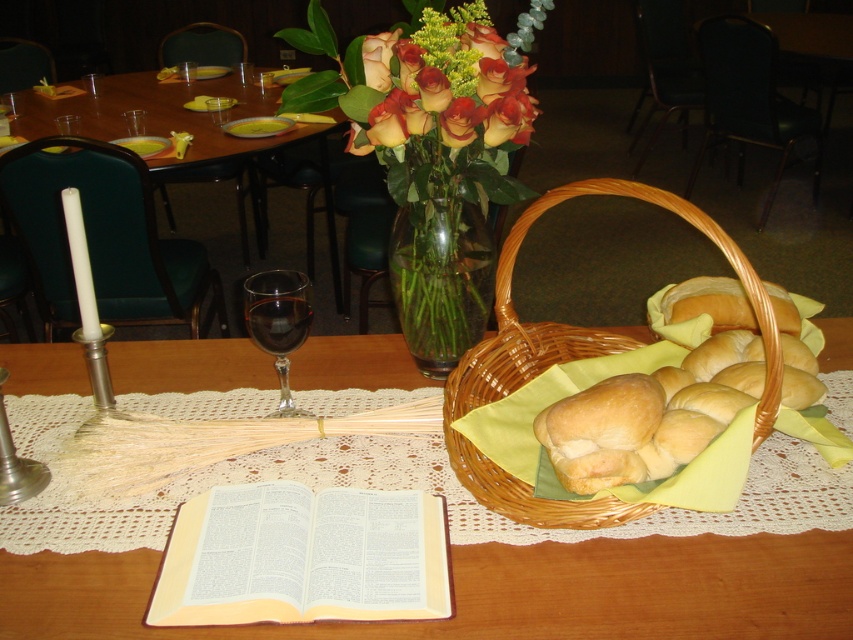
Question: Can you confirm if light brown leather book at center is positioned to the right of transparent glass at center?

Choices:
 (A) yes
 (B) no

Answer: (A)

Question: Among these points, which one is farthest from the camera?

Choices:
 (A) (74, 630)
 (B) (259, 330)
 (C) (416, 284)
 (D) (158, 577)

Answer: (C)

Question: Is matte orange roses at upper center to the left of translucent glass wine at center from the viewer's perspective?

Choices:
 (A) yes
 (B) no

Answer: (B)

Question: Does matte orange roses at upper center have a larger size compared to translucent glass wine at center?

Choices:
 (A) no
 (B) yes

Answer: (B)

Question: Considering the real-world distances, which object is farthest from the woven brown basket at center?

Choices:
 (A) matte orange roses at upper center
 (B) transparent glass at center
 (C) matte wooden table at center
 (D) translucent glass wine at center

Answer: (C)

Question: Which object appears farthest from the camera in this image?

Choices:
 (A) transparent glass at center
 (B) clear glass vase at center

Answer: (B)